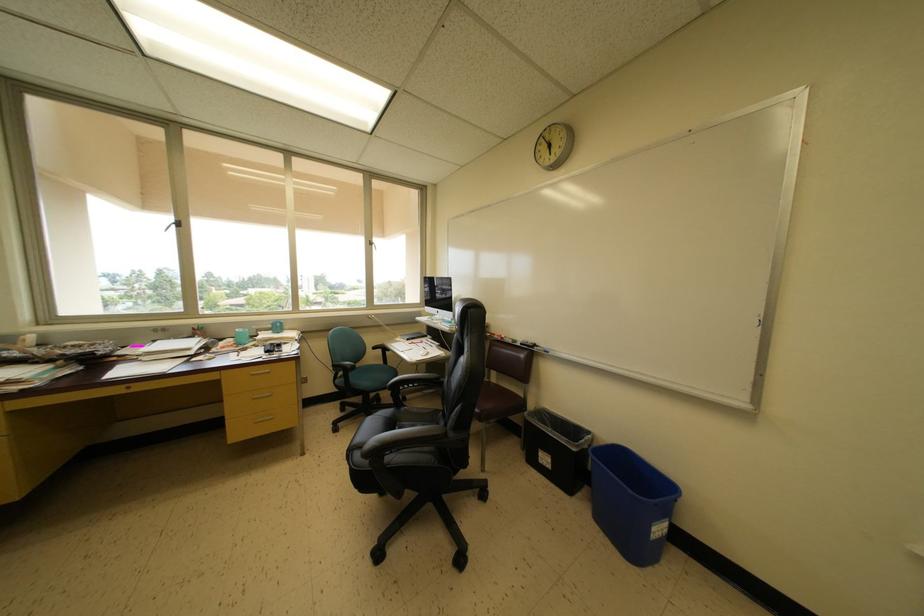
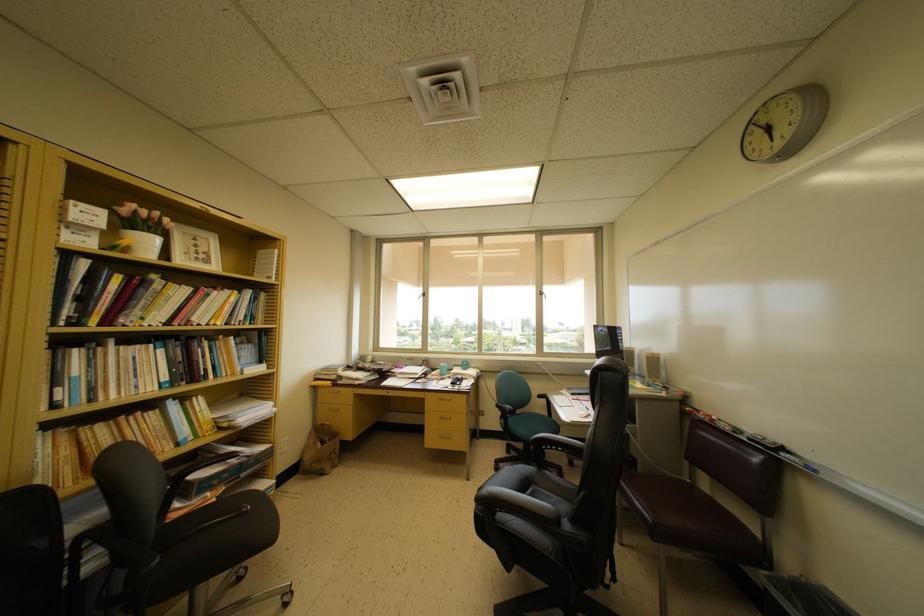
Locate, in the second image, the point that corresponds to (385,368) in the first image.

(551, 419)